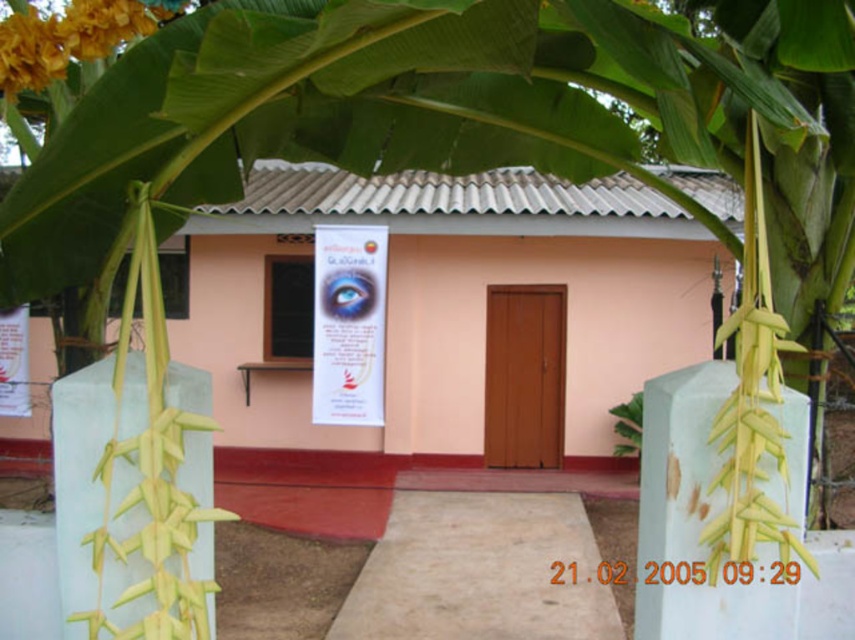
Question: Which point appears farthest from the camera in this image?

Choices:
 (A) (148, 8)
 (B) (624, 401)

Answer: (B)

Question: Among these points, which one is farthest from the camera?

Choices:
 (A) (28, 80)
 (B) (612, 424)

Answer: (B)

Question: Is yellow papery flower at upper left thinner than green leafy plant at center?

Choices:
 (A) yes
 (B) no

Answer: (B)

Question: Is yellow papery flower at upper left to the left of green leafy plant at center from the viewer's perspective?

Choices:
 (A) yes
 (B) no

Answer: (A)

Question: Does yellow papery flower at upper left have a larger size compared to green leafy plant at center?

Choices:
 (A) no
 (B) yes

Answer: (B)

Question: Which of the following is the farthest from the observer?

Choices:
 (A) (612, 429)
 (B) (111, 8)

Answer: (A)